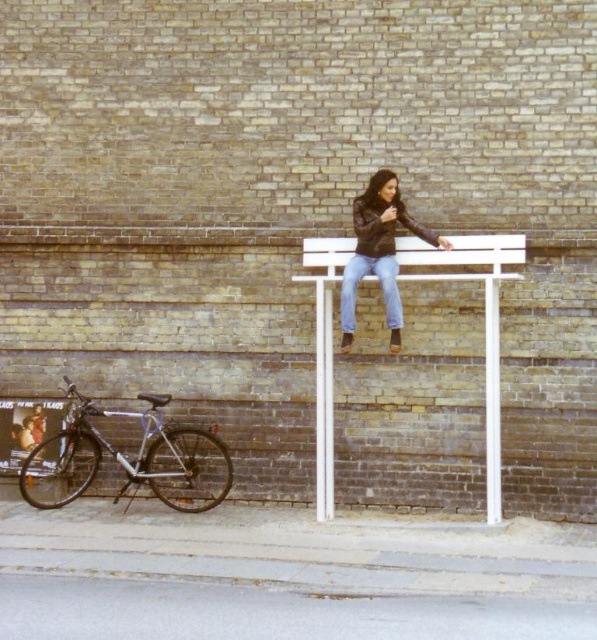
You are a delivery person who needs to park your silver metallic bicycle at lower left near the blue denim jeans at center. Given that the bicycle is larger than the jeans, will it fit in the space where the jeans are located?

The silver metallic bicycle at lower left is larger than the blue denim jeans at center, so it may not fit in the space where the jeans are located. Check the available space carefully before parking.

You are a fashion designer observing the urban scene. You notice the leather jacket at center and the blue denim jeans at center. Which clothing item takes up more space in the scene?

The leather jacket at center is bigger than blue denim jeans at center, so the leather jacket takes up more space in the scene.

You are a photographer taking a picture of the scene. You want to ensure both the silver metallic bicycle at lower left and the blue denim jeans at center are clearly visible. Which object should you focus on first to ensure depth of field captures both?

You should focus on the silver metallic bicycle at lower left first because the blue denim jeans at center is behind it, ensuring the depth of field will include both objects when focusing on the closer one.